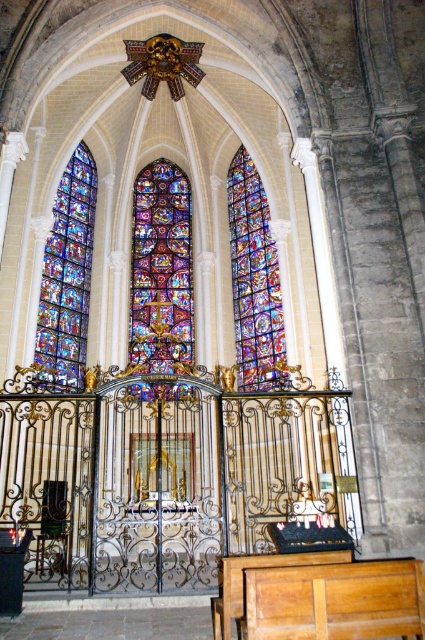
Question: Observing the image, what is the correct spatial positioning of stained glass window at left in reference to multicolored stained glass at center?

Choices:
 (A) right
 (B) left

Answer: (B)

Question: Which point appears closest to the camera in this image?

Choices:
 (A) (249, 273)
 (B) (54, 346)

Answer: (B)

Question: Can you confirm if stained glass window at center is positioned above multicolored stained glass at center?

Choices:
 (A) no
 (B) yes

Answer: (A)

Question: Can you confirm if stained glass window at center is positioned below multicolored stained glass at center?

Choices:
 (A) no
 (B) yes

Answer: (B)

Question: Which point appears closest to the camera in this image?

Choices:
 (A) (263, 344)
 (B) (144, 348)

Answer: (A)

Question: Which of the following is the closest to the observer?

Choices:
 (A) (170, 339)
 (B) (263, 192)

Answer: (A)